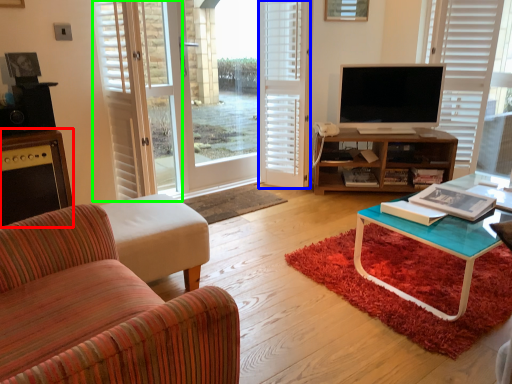
Question: Which is farther away from cabinetry (highlighted by a red box)? shutter (highlighted by a blue box) or screen door (highlighted by a green box)?

Choices:
 (A) shutter
 (B) screen door

Answer: (A)